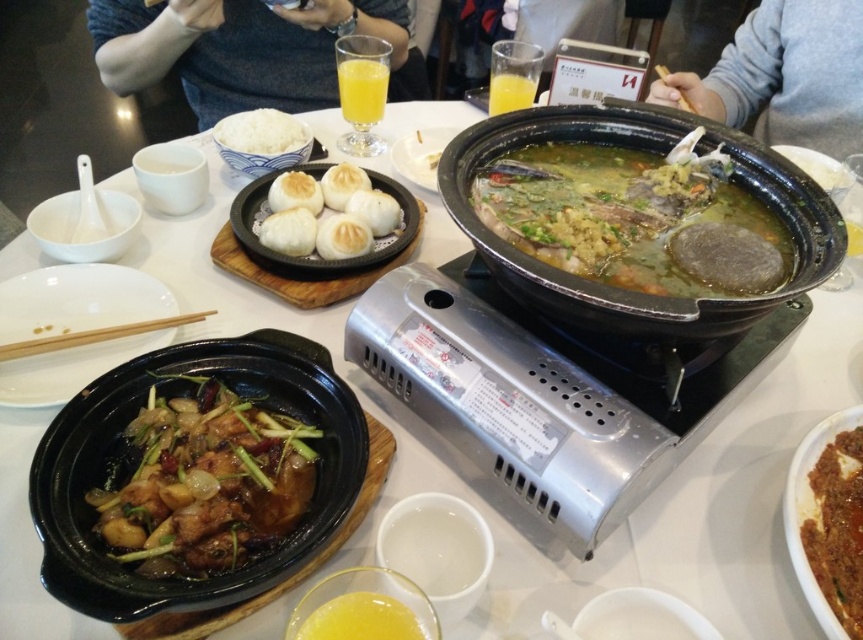
You are a waiter at the restaurant and need to place a 10 cm wide dessert plate between the white matte rice at upper left and the translucent glass of orange juice at center. Can you fit it there?

The white matte rice at upper left and the translucent glass of orange juice at center are 8.69 centimeters apart. Since the dessert plate is 10 cm wide, it won not fit between them as the space is smaller than the plate.

You are a waiter in a busy restaurant and need to quickly serve a customer who is seated at the table. The customer has requested both the white matte rice at upper left and the translucent glass of orange juice at center. Based on their positions, which item should you grab first to ensure efficient service?

The white matte rice at upper left should be grabbed first since it is positioned on the left side of the translucent glass of orange juice at center, making it closer to the customer.

Consider the image. You are a server at the restaurant and need to place a new dish on the table. There is a gray sweater at upper right and a yellow translucent liquid at lower center. Which object should you avoid placing the dish near to maintain proper spacing?

You should avoid placing the dish near the gray sweater at upper right because it is to the right of the yellow translucent liquid at lower center, so the sweater is closer to the edge where you might want to place the dish.